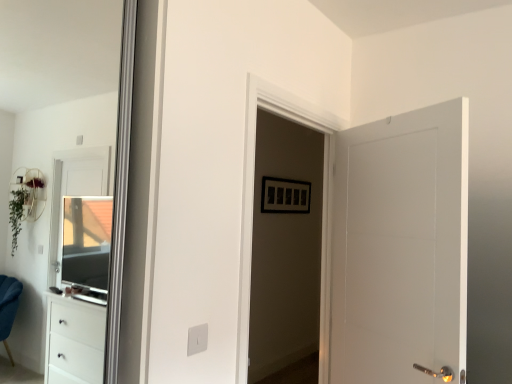
Question: Is clear glass window at left spatially inside white glossy door at center, or outside of it?

Choices:
 (A) outside
 (B) inside

Answer: (A)

Question: In the image, is clear glass window at left on the left side or the right side of white glossy door at center?

Choices:
 (A) left
 (B) right

Answer: (A)

Question: Based on their relative distances, which object is farther from the white matte door at right?

Choices:
 (A) white glossy door at center
 (B) clear glass window at left

Answer: (B)

Question: Estimate the real-world distances between objects in this image. Which object is farther from the white matte door at right?

Choices:
 (A) clear glass window at left
 (B) white glossy door at center

Answer: (A)